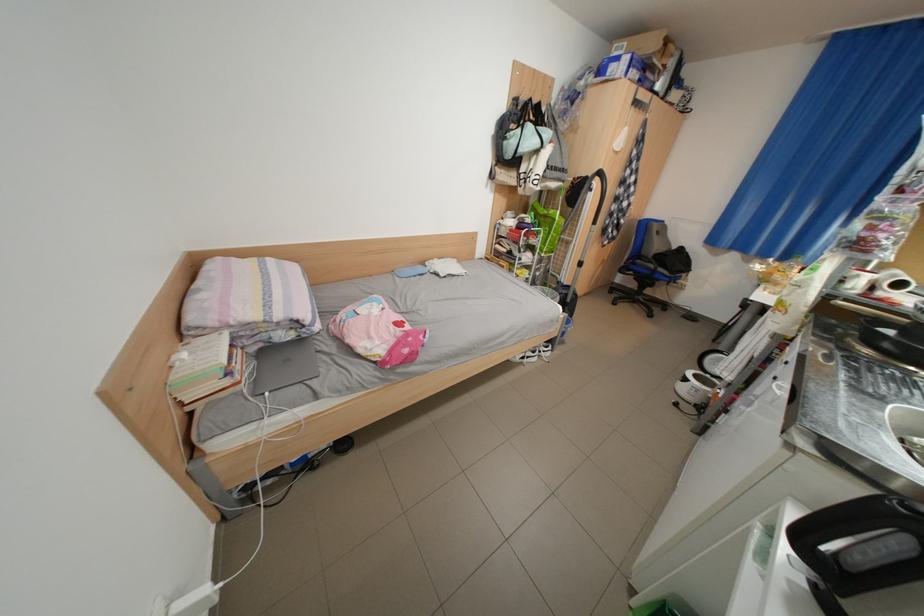
Find the location of a particular element. The width and height of the screenshot is (924, 616). chair sitting surface is located at coordinates (673, 261).